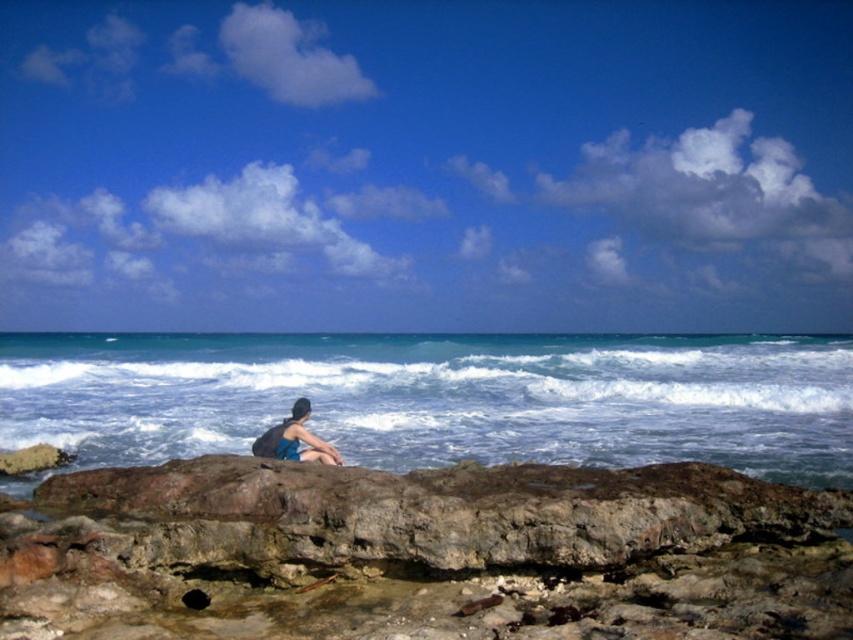
You are standing at the shore looking out at the rocky outcrop. There are two points marked on the rocks. The first point is at coordinates point (664, 365) and the second is at point (293, 416). Which point is closer to you?

Point (293, 416) is closer to you because it is in front of point (664, 365).